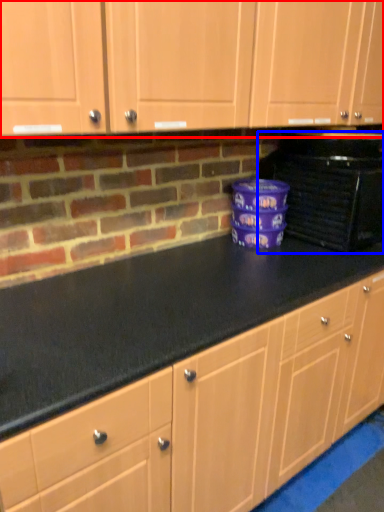
Question: Which object appears closest to the camera in this image, cabinetry (highlighted by a red box) or home appliance (highlighted by a blue box)?

Choices:
 (A) cabinetry
 (B) home appliance

Answer: (A)